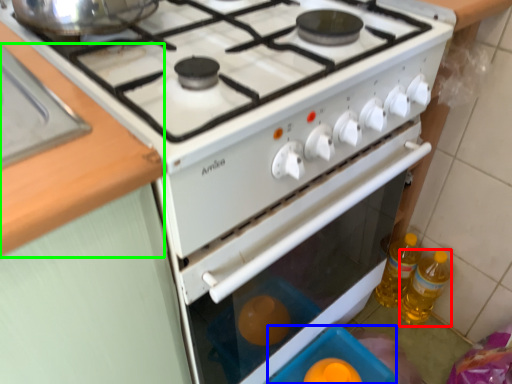
Question: Which object is positioned closest to bottle (highlighted by a red box)? Select from appliance (highlighted by a blue box) and counter top (highlighted by a green box).

Choices:
 (A) appliance
 (B) counter top

Answer: (A)